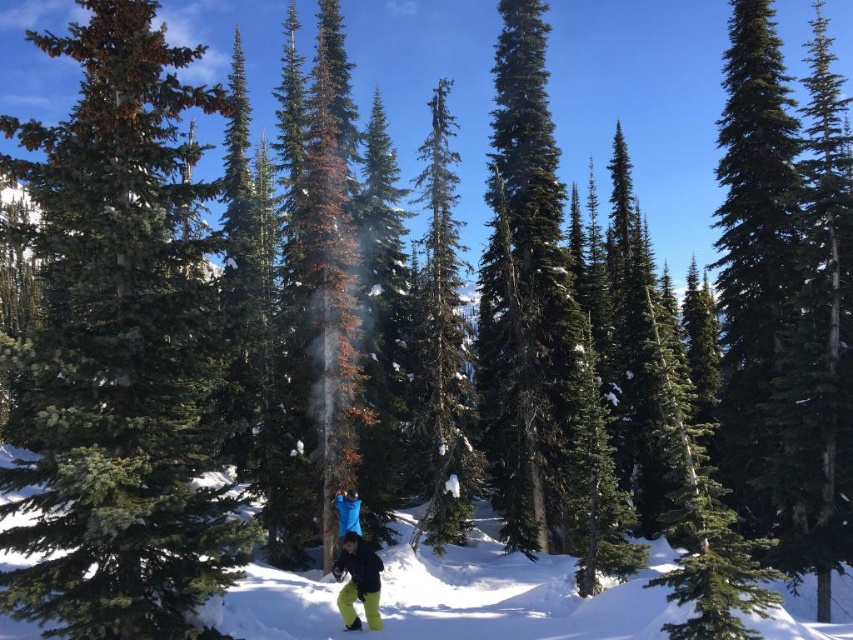
Question: Considering the real-world distances, which object is farthest from the green matte tree at center?

Choices:
 (A) white powdery snow at center
 (B) neon yellow pants at center

Answer: (B)

Question: Where is green matte tree at center located in relation to white powdery snow at center in the image?

Choices:
 (A) above
 (B) below

Answer: (A)

Question: Can you confirm if white powdery snow at center is smaller than neon yellow pants at center?

Choices:
 (A) no
 (B) yes

Answer: (A)

Question: Among these objects, which one is farthest from the camera?

Choices:
 (A) neon yellow pants at center
 (B) white powdery snow at center

Answer: (A)

Question: Among these points, which one is nearest to the camera?

Choices:
 (A) (338, 600)
 (B) (44, 248)
 (C) (309, 620)

Answer: (B)

Question: Is green matte tree at center wider than neon yellow pants at center?

Choices:
 (A) yes
 (B) no

Answer: (A)